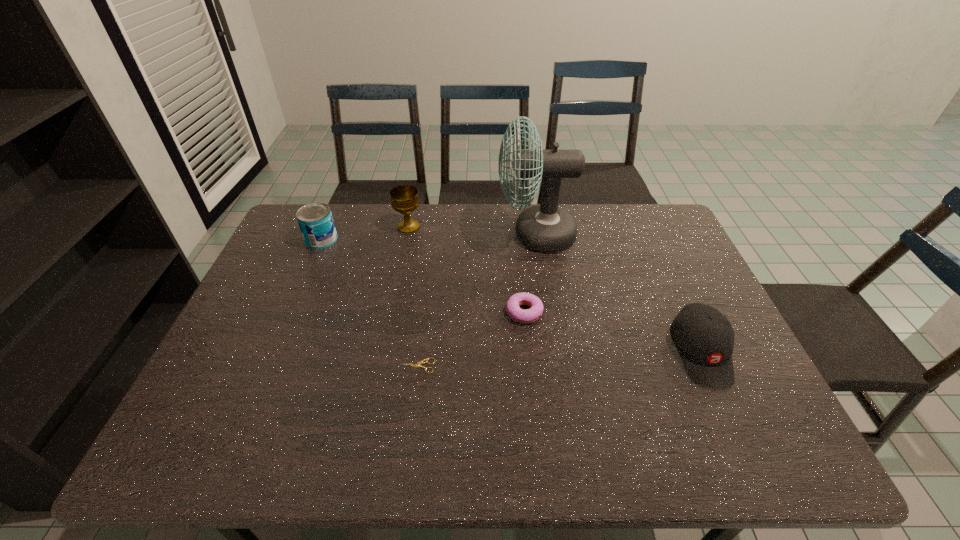
This screenshot has width=960, height=540. I want to click on vacant area that lies between the shortest object and the fan, so click(476, 300).

I want to click on free space between the shears and the tallest object, so click(476, 300).

You are a GUI agent. You are given a task and a screenshot of the screen. Output one action in this format:
    pyautogui.click(x=<x>, y=<y>)
    Task: Click on the empty space that is in between the chalice and the doughnut
    
    Given the screenshot: What is the action you would take?
    pyautogui.click(x=467, y=270)

Locate an element on the screen. vacant area between the leftmost object and the chalice is located at coordinates (365, 233).

Where is `empty space that is in between the fan and the fifth shortest object`? This screenshot has width=960, height=540. empty space that is in between the fan and the fifth shortest object is located at coordinates (472, 231).

This screenshot has width=960, height=540. I want to click on blank region between the chalice and the shears, so click(413, 296).

Identify which object is located as the third nearest to the tallest object. Please provide its 2D coordinates. Your answer should be formatted as a tuple, i.e. [(x, y)], where the tuple contains the x and y coordinates of a point satisfying the conditions above.

[(704, 338)]

Find the location of a particular element. The width and height of the screenshot is (960, 540). object that is the second closest to the baseball cap is located at coordinates (531, 315).

Locate an element on the screen. The height and width of the screenshot is (540, 960). vacant space that satisfies the following two spatial constraints: 1. on the front side of the chalice; 2. on the left side of the fifth tallest object is located at coordinates (391, 313).